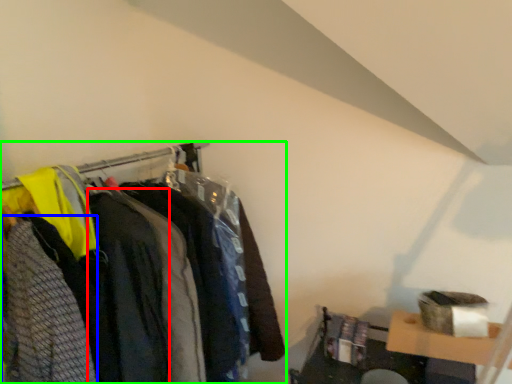
Question: Which object is positioned farthest from clothing (highlighted by a red box)? Select from clothing (highlighted by a blue box) and closet (highlighted by a green box).

Choices:
 (A) clothing
 (B) closet

Answer: (B)